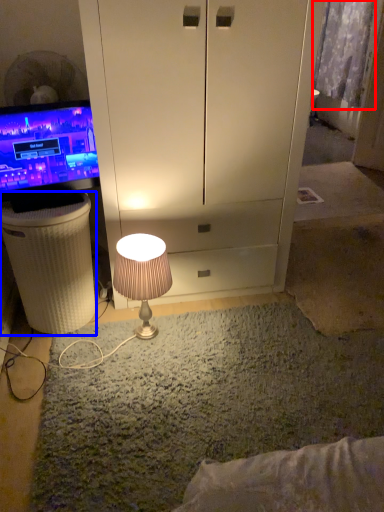
Question: Among these objects, which one is farthest to the camera, curtain (highlighted by a red box) or vanity (highlighted by a blue box)?

Choices:
 (A) curtain
 (B) vanity

Answer: (A)